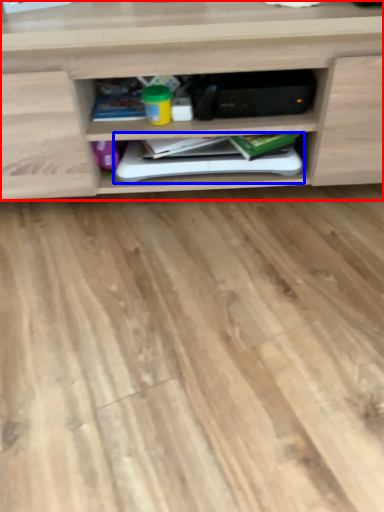
Question: Which point is closer to the camera, shelf (highlighted by a red box) or book (highlighted by a blue box)?

Choices:
 (A) shelf
 (B) book

Answer: (A)